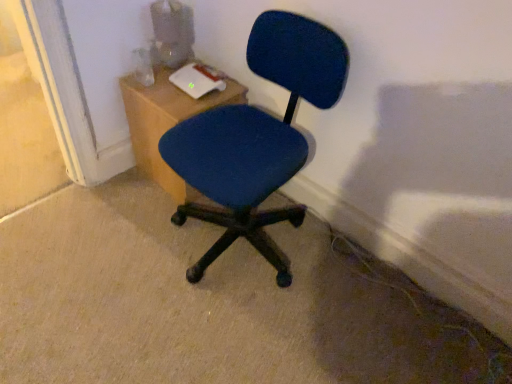
At what (x,y) coordinates should I click in order to perform the action: click on vacant region below blue fabric chair at center (from a real-world perspective). Please return your answer as a coordinate pair (x, y). Looking at the image, I should click on (242, 247).